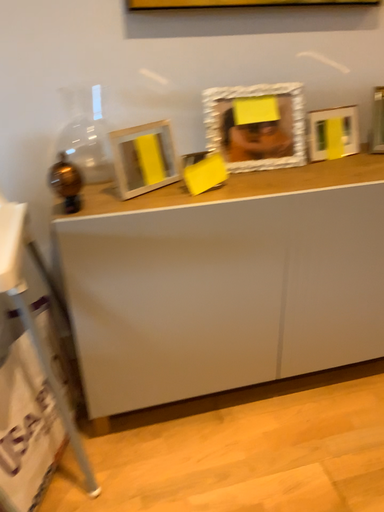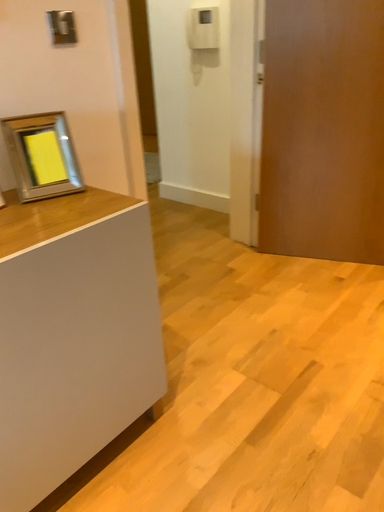
Question: Which way did the camera rotate in the video?

Choices:
 (A) rotated right
 (B) rotated left

Answer: (A)